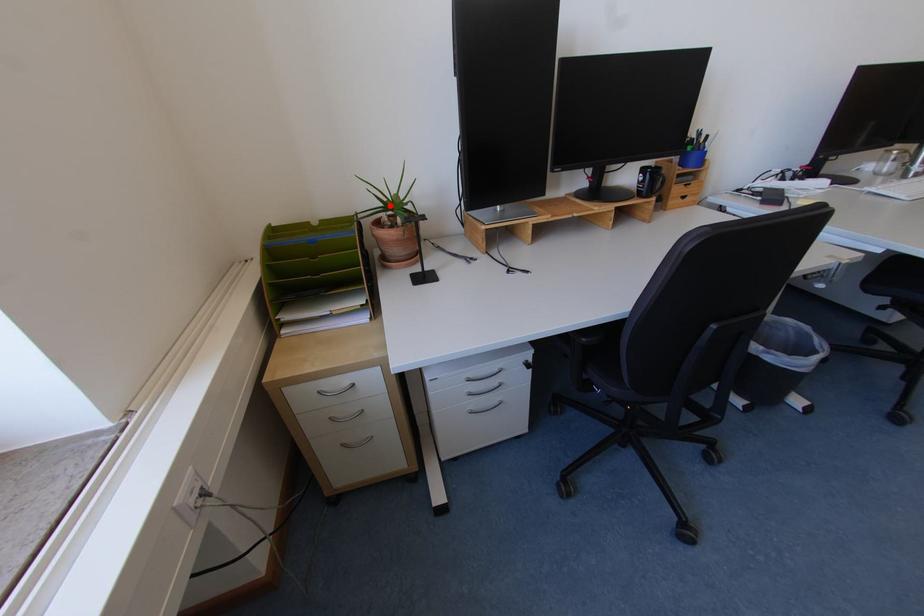
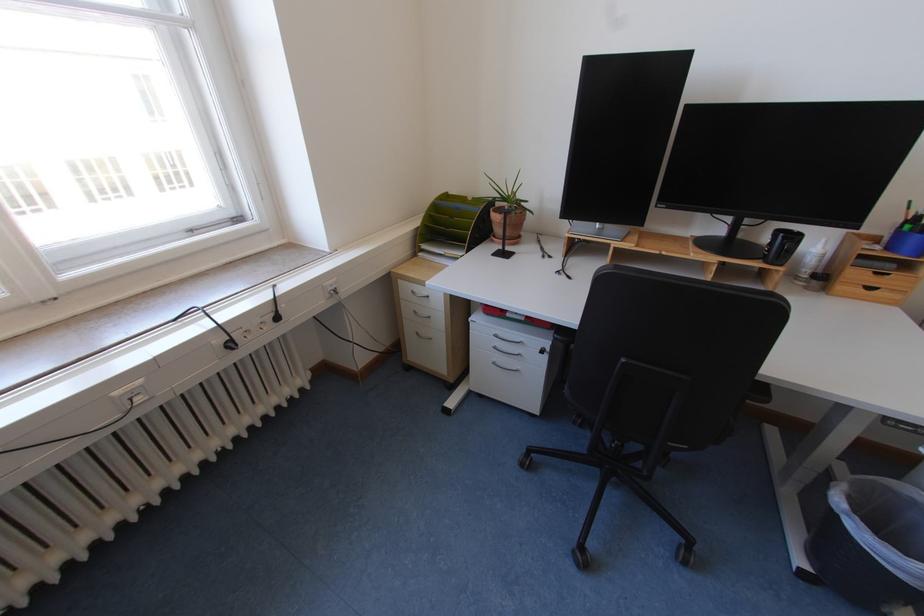
The point at the highlighted location is marked in the first image. Where is the corresponding point in the second image?

(506, 197)